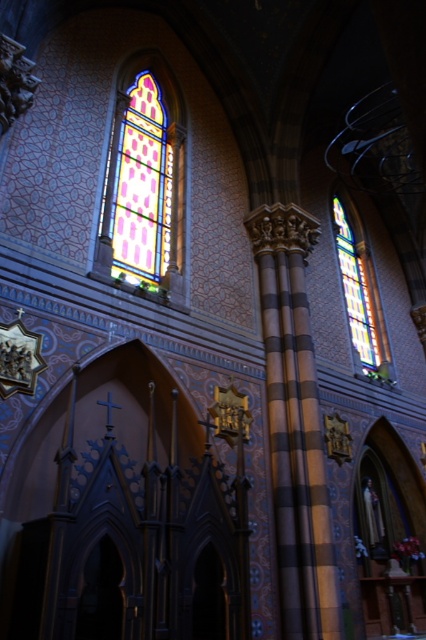
You are an architect analyzing the symmetry of the church. Which stained glass window, the stained glass window at upper left or the stained glass window at upper right, is bigger in size?

The stained glass window at upper left is larger in size compared to the stained glass window at upper right.

You are an architect examining the church interior. You notice two stained glass windows, the stained glass window at upper left and the stained glass window at upper right. Which one is taller?

The stained glass window at upper left is taller than the stained glass window at upper right.

You are standing at the entrance of the church and notice two stained glass windows, the stained glass window at upper left and the stained glass window at upper right. Which one appears nearer to you?

The stained glass window at upper left appears nearer to you because it is closer to the viewer than the stained glass window at upper right.